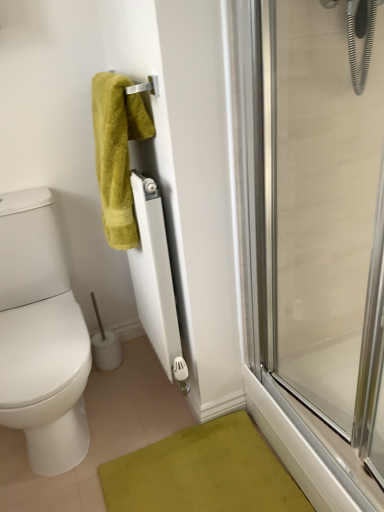
The width and height of the screenshot is (384, 512). What are the coordinates of `white matte radiator at center` in the screenshot? It's located at (154, 273).

What do you see at coordinates (315, 221) in the screenshot?
I see `transparent glass shower door at right` at bounding box center [315, 221].

This screenshot has width=384, height=512. What do you see at coordinates (117, 153) in the screenshot?
I see `green fuzzy towel at upper left` at bounding box center [117, 153].

I want to click on white matte radiator at center, so click(154, 273).

How far apart are white matte radiator at center and transparent glass shower door at right?

white matte radiator at center is 16.32 inches away from transparent glass shower door at right.

From the image's perspective, is white matte radiator at center above or below transparent glass shower door at right?

From the image's perspective, white matte radiator at center appears below transparent glass shower door at right.

In the scene shown: From a real-world perspective, is white matte radiator at center below transparent glass shower door at right?

Yes, from a real-world perspective, white matte radiator at center is below transparent glass shower door at right.

Which of these two, white matte radiator at center or transparent glass shower door at right, is smaller?

transparent glass shower door at right is smaller.

Considering their positions, is white matte radiator at center located in front of or behind green fuzzy towel at upper left?

In the image, white matte radiator at center appears behind green fuzzy towel at upper left.

From the image's perspective, between white matte radiator at center and green fuzzy towel at upper left, which one is located above?

green fuzzy towel at upper left, from the image's perspective.

From a real-world perspective, is white matte radiator at center physically located above or below green fuzzy towel at upper left?

white matte radiator at center is below green fuzzy towel at upper left.

Is green fuzzy towel at upper left oriented towards white matte radiator at center?

No, green fuzzy towel at upper left is not aimed at white matte radiator at center.

At what (x,y) coordinates should I click in order to perform the action: click on radiator on the right of the green fuzzy towel at upper left. Please return your answer as a coordinate pair (x, y). The height and width of the screenshot is (512, 384). Looking at the image, I should click on (154, 273).

Would you say green fuzzy towel at upper left is a long distance from white matte radiator at center?

Actually, green fuzzy towel at upper left and white matte radiator at center are a little close together.

From a real-world perspective, is green fuzzy towel at upper left on white matte radiator at center?

Yes, from a real-world perspective, green fuzzy towel at upper left is on top of white matte radiator at center.

Considering the relative sizes of transparent glass shower door at right and white matte radiator at center in the image provided, is transparent glass shower door at right smaller than white matte radiator at center?

Correct, transparent glass shower door at right occupies less space than white matte radiator at center.

Relative to white matte radiator at center, is transparent glass shower door at right in front or behind?

transparent glass shower door at right is positioned closer to the viewer than white matte radiator at center.

From a real-world perspective, is transparent glass shower door at right physically located above or below white matte radiator at center?

transparent glass shower door at right is situated higher than white matte radiator at center in the real world.

Between transparent glass shower door at right and white matte radiator at center, which one has less height?

white matte radiator at center.

In the scene shown: Considering the relative positions of transparent glass shower door at right and green fuzzy towel at upper left in the image provided, is transparent glass shower door at right to the left of green fuzzy towel at upper left from the viewer's perspective?

In fact, transparent glass shower door at right is to the right of green fuzzy towel at upper left.

Based on the photo, considering the relative sizes of transparent glass shower door at right and green fuzzy towel at upper left in the image provided, is transparent glass shower door at right smaller than green fuzzy towel at upper left?

Incorrect, transparent glass shower door at right is not smaller in size than green fuzzy towel at upper left.

Considering their positions, is transparent glass shower door at right located in front of or behind green fuzzy towel at upper left?

transparent glass shower door at right is in front of green fuzzy towel at upper left.

You are a GUI agent. You are given a task and a screenshot of the screen. Output one action in this format:
    pyautogui.click(x=<x>, y=<y>)
    Task: Click on the towel on the left side of transparent glass shower door at right
    The width and height of the screenshot is (384, 512).
    Given the screenshot: What is the action you would take?
    pyautogui.click(x=117, y=153)

What's the angular difference between green fuzzy towel at upper left and transparent glass shower door at right's facing directions?

The angular difference between green fuzzy towel at upper left and transparent glass shower door at right is 9.98 degrees.

Which of these two, green fuzzy towel at upper left or transparent glass shower door at right, is wider?

green fuzzy towel at upper left is wider.

Would you say green fuzzy towel at upper left is outside transparent glass shower door at right?

That's correct, green fuzzy towel at upper left is outside of transparent glass shower door at right.

Can you confirm if green fuzzy towel at upper left is positioned to the right of transparent glass shower door at right?

Incorrect, green fuzzy towel at upper left is not on the right side of transparent glass shower door at right.

Locate an element on the screen. radiator below the transparent glass shower door at right (from the image's perspective) is located at coordinates (154, 273).

In the image, there is a green fuzzy towel at upper left. Find the location of `radiator below it (from a real-world perspective)`. radiator below it (from a real-world perspective) is located at coordinates (x=154, y=273).

Consider the image. Estimate the real-world distances between objects in this image. Which object is closer to white matte radiator at center, transparent glass shower door at right or green fuzzy towel at upper left?

The object closer to white matte radiator at center is green fuzzy towel at upper left.

Estimate the real-world distances between objects in this image. Which object is closer to white matte radiator at center, green fuzzy towel at upper left or transparent glass shower door at right?

green fuzzy towel at upper left.

Based on their spatial positions, is green fuzzy towel at upper left or white matte radiator at center further from transparent glass shower door at right?

Among the two, green fuzzy towel at upper left is located further to transparent glass shower door at right.

When comparing their distances from green fuzzy towel at upper left, does transparent glass shower door at right or white matte radiator at center seem further?

Among the two, transparent glass shower door at right is located further to green fuzzy towel at upper left.

When comparing their distances from green fuzzy towel at upper left, does white matte radiator at center or transparent glass shower door at right seem closer?

The object closer to green fuzzy towel at upper left is white matte radiator at center.

Considering their positions, is white matte radiator at center positioned closer to transparent glass shower door at right than green fuzzy towel at upper left?

white matte radiator at center is closer to transparent glass shower door at right.

Where is `radiator situated between green fuzzy towel at upper left and transparent glass shower door at right from left to right`? radiator situated between green fuzzy towel at upper left and transparent glass shower door at right from left to right is located at coordinates pos(154,273).